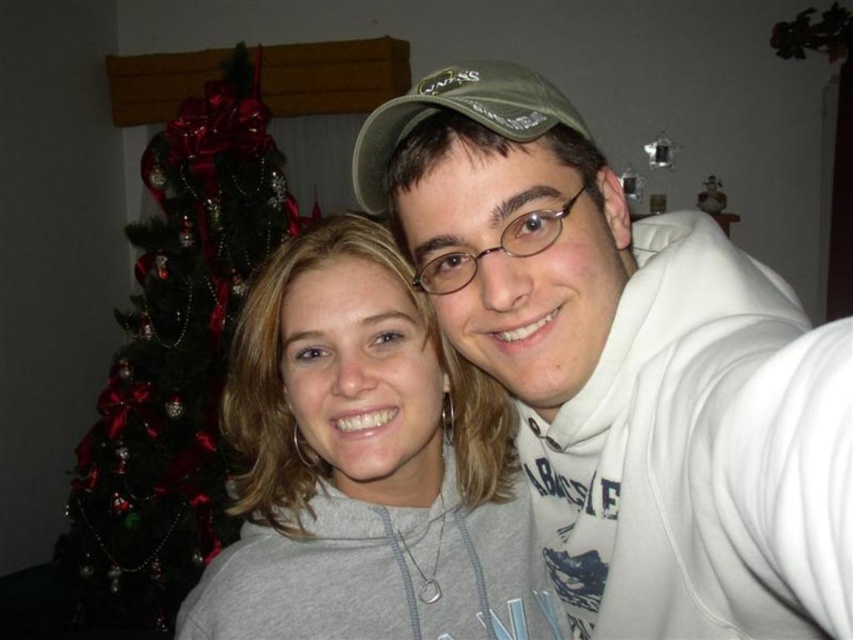
Question: Does gray matte sweatshirt at center appear under green matte christmas tree at left?

Choices:
 (A) no
 (B) yes

Answer: (B)

Question: Estimate the real-world distances between objects in this image. Which object is closer to the green fabric baseball cap at upper center?

Choices:
 (A) white fleece sweatshirt at center
 (B) green matte christmas tree at left
 (C) gray matte sweatshirt at center

Answer: (A)

Question: Does white fleece sweatshirt at center have a larger size compared to green matte christmas tree at left?

Choices:
 (A) no
 (B) yes

Answer: (A)

Question: Which is nearer to the white fleece sweatshirt at center?

Choices:
 (A) gray matte sweatshirt at center
 (B) green matte christmas tree at left
 (C) green fabric baseball cap at upper center

Answer: (A)

Question: Estimate the real-world distances between objects in this image. Which object is closer to the gray matte sweatshirt at center?

Choices:
 (A) green fabric baseball cap at upper center
 (B) green matte christmas tree at left
 (C) white fleece sweatshirt at center

Answer: (C)

Question: Is gray matte sweatshirt at center below green fabric baseball cap at upper center?

Choices:
 (A) no
 (B) yes

Answer: (B)